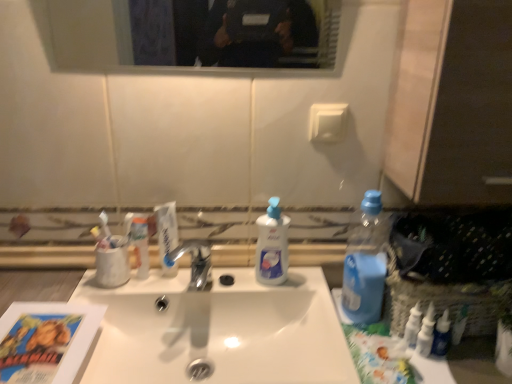
The image size is (512, 384). Describe the element at coordinates (272, 245) in the screenshot. I see `white glossy liquid soap at center` at that location.

This screenshot has height=384, width=512. Find the location of `white glossy liquid soap at center`. white glossy liquid soap at center is located at coordinates (272, 245).

Where is `clear glass mirror at upper center`? Image resolution: width=512 pixels, height=384 pixels. clear glass mirror at upper center is located at coordinates click(194, 33).

Image resolution: width=512 pixels, height=384 pixels. Describe the element at coordinates (140, 243) in the screenshot. I see `translucent plastic tube at center, which is counted as the 3th toiletry, starting from the right` at that location.

The width and height of the screenshot is (512, 384). Describe the element at coordinates (365, 264) in the screenshot. I see `blue plastic bottle at right` at that location.

You are a GUI agent. You are given a task and a screenshot of the screen. Output one action in this format:
    pyautogui.click(x=<x>, y=<y>)
    Task: Click on the blue plastic bottle at right
    
    Given the screenshot: What is the action you would take?
    pyautogui.click(x=365, y=264)

At what (x,y) coordinates should I click in order to perform the action: click on white glossy sink at center. Please return your answer as a coordinate pair (x, y). Looking at the image, I should click on (218, 330).

Which object is positioned more to the left, translucent plastic tube at center, acting as the first toiletry starting from the left, or white glossy liquid soap at center?

Positioned to the left is translucent plastic tube at center, acting as the first toiletry starting from the left.

Does point (138, 248) lie behind point (269, 274)?

No.

Is white glossy liquid soap at center at the back of translucent plastic tube at center, which appears as the 3th toiletry when viewed from the front?

translucent plastic tube at center, which appears as the 3th toiletry when viewed from the front, does not have its back to white glossy liquid soap at center.

This screenshot has width=512, height=384. There is a white glossy liquid soap at center. What are the coordinates of `the 1st toiletry below it (from the image's perspective)` in the screenshot? It's located at (140, 243).

Are translucent plastic tube at center, which is counted as the 3th toiletry, starting from the right, and white plastic bottles at right, the 2th toiletry in the back-to-front sequence, making contact?

There is a gap between translucent plastic tube at center, which is counted as the 3th toiletry, starting from the right, and white plastic bottles at right, the 2th toiletry in the back-to-front sequence.

Between translucent plastic tube at center, which is counted as the 3th toiletry, starting from the right, and white plastic bottles at right, the 2th toiletry in the back-to-front sequence, which one has smaller size?

With smaller size is white plastic bottles at right, the 2th toiletry in the back-to-front sequence.

From a real-world perspective, between translucent plastic tube at center, which appears as the 3th toiletry when viewed from the front, and white plastic bottles at right, which is the 2th toiletry in front-to-back order, who is vertically higher?

In real-world perspective, translucent plastic tube at center, which appears as the 3th toiletry when viewed from the front, is above.

Is translucent plastic tube at center, the 1th toiletry when ordered from back to front, turned away from white plastic bottles at right, the second toiletry in the left-to-right sequence?

No, translucent plastic tube at center, the 1th toiletry when ordered from back to front, is not facing the opposite direction of white plastic bottles at right, the second toiletry in the left-to-right sequence.

From the picture: Is white glossy liquid soap at center positioned far away from white plastic bottles at right, the 2th toiletry in the back-to-front sequence?

No.

Who is taller, white glossy liquid soap at center or white plastic bottles at right, positioned as the 2th toiletry in right-to-left order?

white glossy liquid soap at center.

Where is `cleaning product behind the white plastic bottles at right, the second toiletry in the left-to-right sequence`? cleaning product behind the white plastic bottles at right, the second toiletry in the left-to-right sequence is located at coordinates (272, 245).

At what (x,y) coordinates should I click in order to perform the action: click on the 1st toiletry behind the white glossy sink at center, starting your count from the anchor. Please return your answer as a coordinate pair (x, y). Looking at the image, I should click on (441, 335).

What's the angular difference between white glossy sink at center and blue glossy bottle at lower right, placed as the first toiletry when sorted from right to left,'s facing directions?

The facing directions of white glossy sink at center and blue glossy bottle at lower right, placed as the first toiletry when sorted from right to left, are 0.000192 degrees apart.

Is white glossy sink at center to the left of blue glossy bottle at lower right, the 1th toiletry when ordered from front to back, from the viewer's perspective?

Correct, you'll find white glossy sink at center to the left of blue glossy bottle at lower right, the 1th toiletry when ordered from front to back.

Which object is wider, white glossy sink at center or blue glossy bottle at lower right, the 1th toiletry when ordered from front to back?

With larger width is white glossy sink at center.

Can you confirm if white plastic bottles at right, the second toiletry in the left-to-right sequence, is taller than blue plastic bottle at right?

In fact, white plastic bottles at right, the second toiletry in the left-to-right sequence, may be shorter than blue plastic bottle at right.

Can you confirm if white plastic bottles at right, the 2th toiletry in the back-to-front sequence, is wider than blue plastic bottle at right?

No, white plastic bottles at right, the 2th toiletry in the back-to-front sequence, is not wider than blue plastic bottle at right.

Where is `bottle that is on the left side of white plastic bottles at right, the second toiletry in the left-to-right sequence`? This screenshot has height=384, width=512. bottle that is on the left side of white plastic bottles at right, the second toiletry in the left-to-right sequence is located at coordinates (365, 264).

Considering the sizes of objects white plastic bottles at right, the second toiletry in the left-to-right sequence, and blue plastic bottle at right in the image provided, who is smaller, white plastic bottles at right, the second toiletry in the left-to-right sequence, or blue plastic bottle at right?

Smaller between the two is white plastic bottles at right, the second toiletry in the left-to-right sequence.

From the image's perspective, which is below, blue plastic bottle at right or translucent plastic tube at center, which is counted as the 3th toiletry, starting from the right?

From the image's view, blue plastic bottle at right is below.

Looking at this image, from a real-world perspective, is blue plastic bottle at right beneath translucent plastic tube at center, the 1th toiletry when ordered from back to front?

No, from a real-world perspective, blue plastic bottle at right is not beneath translucent plastic tube at center, the 1th toiletry when ordered from back to front.

Is blue glossy bottle at lower right, the third toiletry when ordered from left to right, oriented away from translucent plastic tube at center, acting as the first toiletry starting from the left?

No.

Between blue glossy bottle at lower right, placed as the first toiletry when sorted from right to left, and translucent plastic tube at center, the 1th toiletry when ordered from back to front, which one is positioned in front?

blue glossy bottle at lower right, placed as the first toiletry when sorted from right to left, is in front.

Does point (447, 338) lie behind point (141, 233)?

No, (447, 338) is closer to viewer.

From the image's perspective, count 1st toiletrys downward from the white glossy liquid soap at center and point to it. Please provide its 2D coordinates.

[(140, 243)]

You are a GUI agent. You are given a task and a screenshot of the screen. Output one action in this format:
    pyautogui.click(x=<x>, y=<y>)
    Task: Click on the toiletry above the white plastic bottles at right, positioned as the 2th toiletry in right-to-left order (from a real-world perspective)
    This screenshot has height=384, width=512.
    Given the screenshot: What is the action you would take?
    pyautogui.click(x=140, y=243)

Considering their positions, is white plastic bottles at right, which is the 2th toiletry in front-to-back order, positioned closer to white glossy sink at center than blue glossy bottle at lower right, the 1th toiletry when ordered from front to back?

white plastic bottles at right, which is the 2th toiletry in front-to-back order.

Based on their spatial positions, is blue plastic bottle at right or white glossy sink at center further from white glossy liquid soap at center?

blue plastic bottle at right is further to white glossy liquid soap at center.

When comparing their distances from white glossy liquid soap at center, does white glossy toothpaste at center or white plastic bottles at right, the 2th toiletry in the back-to-front sequence, seem closer?

Among the two, white glossy toothpaste at center is located nearer to white glossy liquid soap at center.

Consider the image. Looking at the image, which one is located further to white glossy toothpaste at center, translucent plastic tube at center, which appears as the 3th toiletry when viewed from the front, or clear glass mirror at upper center?

The object further to white glossy toothpaste at center is clear glass mirror at upper center.

From the image, which object appears to be farther from translucent plastic tube at center, the 1th toiletry when ordered from back to front, white glossy sink at center or white glossy toothpaste at center?

white glossy sink at center lies further to translucent plastic tube at center, the 1th toiletry when ordered from back to front, than the other object.

From the image, which object appears to be farther from blue plastic bottle at right, white glossy liquid soap at center or white glossy toothpaste at center?

The object further to blue plastic bottle at right is white glossy toothpaste at center.

Which object lies nearer to the anchor point clear glass mirror at upper center, blue glossy bottle at lower right, placed as the first toiletry when sorted from right to left, or white glossy toothpaste at center?

Among the two, white glossy toothpaste at center is located nearer to clear glass mirror at upper center.

Consider the image. Estimate the real-world distances between objects in this image. Which object is closer to white glossy liquid soap at center, white glossy sink at center or clear glass mirror at upper center?

Based on the image, white glossy sink at center appears to be nearer to white glossy liquid soap at center.

Identify the location of toiletry situated between translucent plastic tube at center, acting as the first toiletry starting from the left, and blue glossy bottle at lower right, placed as the first toiletry when sorted from right to left, from left to right. (413, 326).

Find the location of `cleaning product between translucent plastic tube at center, the 1th toiletry when ordered from back to front, and blue plastic bottle at right, in the horizontal direction`. cleaning product between translucent plastic tube at center, the 1th toiletry when ordered from back to front, and blue plastic bottle at right, in the horizontal direction is located at coordinates (272, 245).

Where is `cleaning product between white glossy sink at center and blue glossy bottle at lower right, the 1th toiletry when ordered from front to back, from left to right`? Image resolution: width=512 pixels, height=384 pixels. cleaning product between white glossy sink at center and blue glossy bottle at lower right, the 1th toiletry when ordered from front to back, from left to right is located at coordinates (272, 245).

Locate an element on the screen. The height and width of the screenshot is (384, 512). cleaning product between clear glass mirror at upper center and blue plastic bottle at right in the up-down direction is located at coordinates [272, 245].